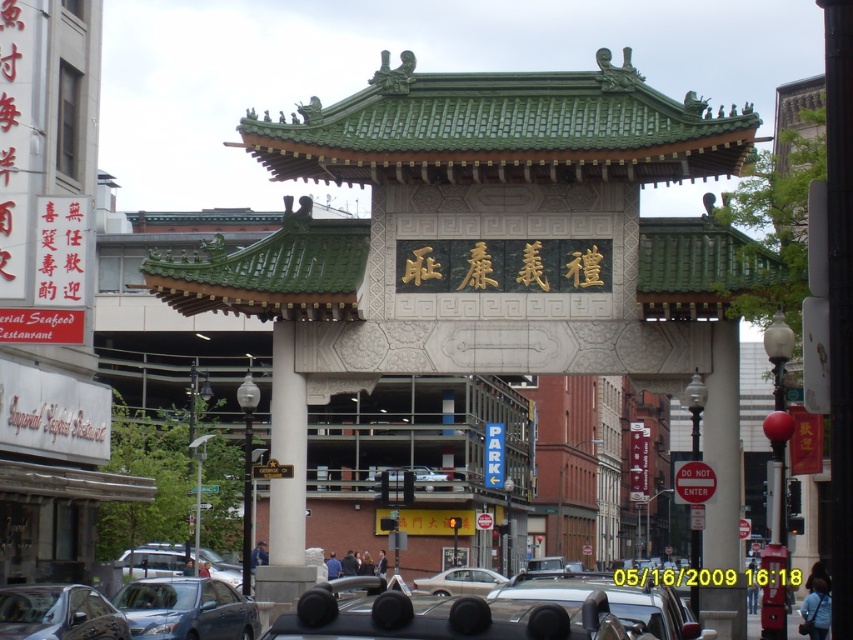
You are a delivery person who needs to park your matte black car at center in a space that requires vehicles to be shorter than the red plastic sign at center. Can your car fit under the sign?

The matte black car at center has a lesser height compared to the red plastic sign at center, so the car can fit under the sign.